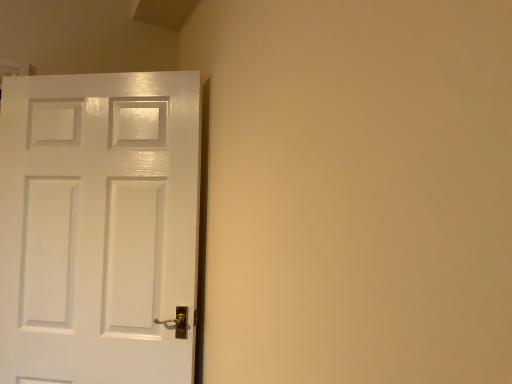
The height and width of the screenshot is (384, 512). Describe the element at coordinates (98, 227) in the screenshot. I see `white glossy door at left` at that location.

Where is `white glossy door at left`? Image resolution: width=512 pixels, height=384 pixels. white glossy door at left is located at coordinates (98, 227).

Measure the distance between white glossy door at left and camera.

The depth of white glossy door at left is 5.14 feet.

At what (x,y) coordinates should I click in order to perform the action: click on white glossy door at left. Please return your answer as a coordinate pair (x, y). The width and height of the screenshot is (512, 384). Looking at the image, I should click on (98, 227).